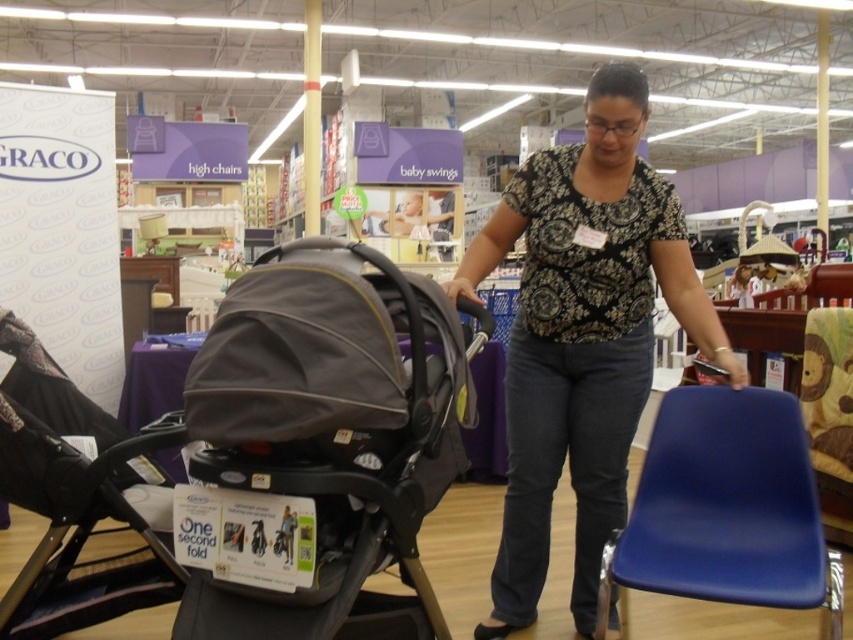
Question: Can you confirm if blue plastic chair at lower right is bigger than matte black stroller at center?

Choices:
 (A) yes
 (B) no

Answer: (B)

Question: Which point is farther to the camera?

Choices:
 (A) printed cotton blouse at center
 (B) gray fabric stroller at center
 (C) blue plastic chair at lower right

Answer: (A)

Question: Among these objects, which one is farthest from the camera?

Choices:
 (A) gray fabric stroller at center
 (B) matte black stroller at center

Answer: (B)

Question: Is printed cotton blouse at center in front of blue plastic chair at lower right?

Choices:
 (A) no
 (B) yes

Answer: (A)

Question: Estimate the real-world distances between objects in this image. Which object is farther from the matte black stroller at center?

Choices:
 (A) blue plastic chair at lower right
 (B) gray fabric stroller at center

Answer: (A)

Question: Is printed cotton blouse at center smaller than matte black stroller at center?

Choices:
 (A) yes
 (B) no

Answer: (B)